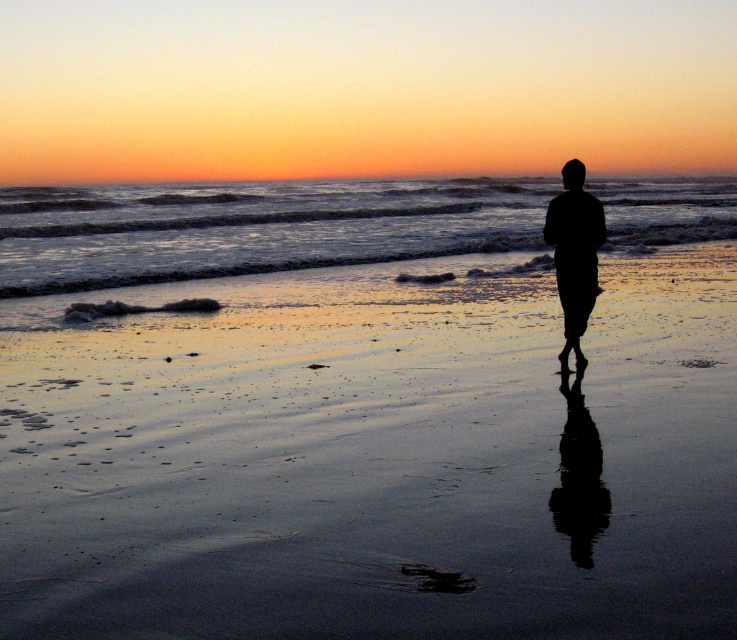
Question: Is shiny sand at center bigger than black matte figure at center?

Choices:
 (A) no
 (B) yes

Answer: (B)

Question: Based on their relative distances, which object is nearer to the shiny sand at center?

Choices:
 (A) clear water at center
 (B) black matte figure at center

Answer: (B)

Question: Which of these objects is positioned farthest from the clear water at center?

Choices:
 (A) shiny sand at center
 (B) black matte figure at center

Answer: (B)

Question: Is clear water at center below black matte figure at center?

Choices:
 (A) yes
 (B) no

Answer: (B)

Question: Is the position of clear water at center less distant than that of black matte figure at center?

Choices:
 (A) yes
 (B) no

Answer: (A)

Question: Which object appears closest to the camera in this image?

Choices:
 (A) black matte figure at center
 (B) shiny sand at center

Answer: (B)